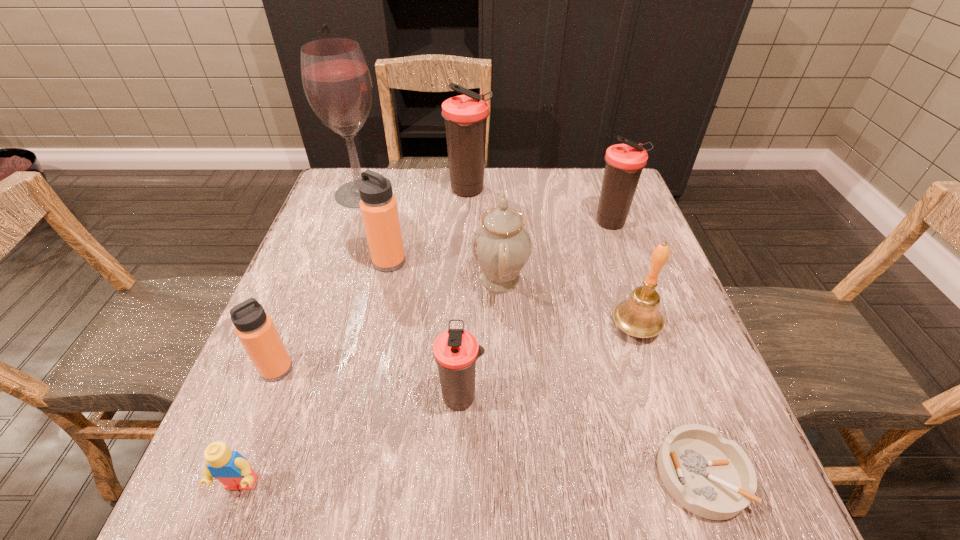
Locate an element on the screen. The width and height of the screenshot is (960, 540). free space in the image that satisfies the following two spatial constraints: 1. on the front side of the shortest object; 2. on the right side of the second smallest brown thermos bottle is located at coordinates (701, 475).

Identify the location of free space that satisfies the following two spatial constraints: 1. on the back side of the shortest object; 2. on the spout of the chinaware. The height and width of the screenshot is (540, 960). (632, 280).

At what (x,y) coordinates should I click in order to perform the action: click on free spot that satisfies the following two spatial constraints: 1. on the front side of the shortest object; 2. on the left side of the nearest brown thermos bottle. Please return your answer as a coordinate pair (x, y). This screenshot has height=540, width=960. Looking at the image, I should click on (459, 475).

Where is `vacant region that satisfies the following two spatial constraints: 1. on the spout of the chinaware; 2. on the front-facing side of the Lego`? vacant region that satisfies the following two spatial constraints: 1. on the spout of the chinaware; 2. on the front-facing side of the Lego is located at coordinates (510, 485).